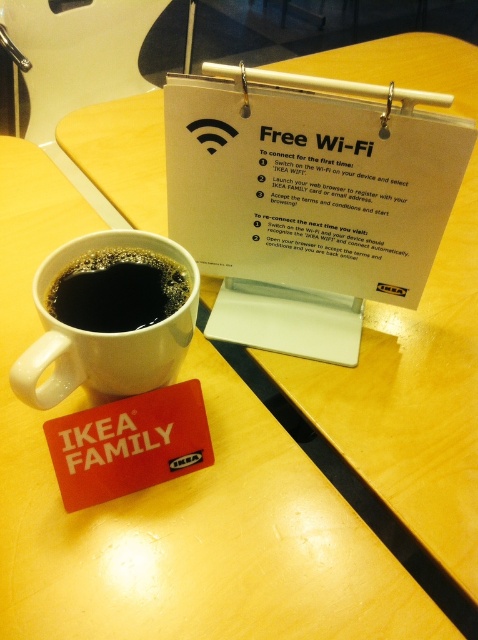
You are an interior designer planning to place a decorative item between the white plastic clipboard at upper center and the black matte cup at lower left. Which object should you place the item closer to if you want it to be near the wider object?

The white plastic clipboard at upper center might be wider than the black matte cup at lower left, so place the decorative item closer to the white plastic clipboard at upper center to be near the wider object.

You are a customer at IKEA who wants to place a 1.5 inch wide spoon between the white matte mug at upper left and the black matte cup at lower left. Will there be enough space?

The white matte mug at upper left and black matte cup at lower left are 1.25 inches apart from each other. Since the spoon is 1.5 inches wide, there isn not enough space to fit it between them.

You are an IKEA employee who needs to locate the white plastic clipboard at upper center. The store uses a coordinate system where the bottom left corner is the origin point. The white ceramic mug is at position (307, 198). Can you determine the coordinates of the white plastic clipboard at upper center?

The coordinates of the white plastic clipboard at upper center are point (307, 198).